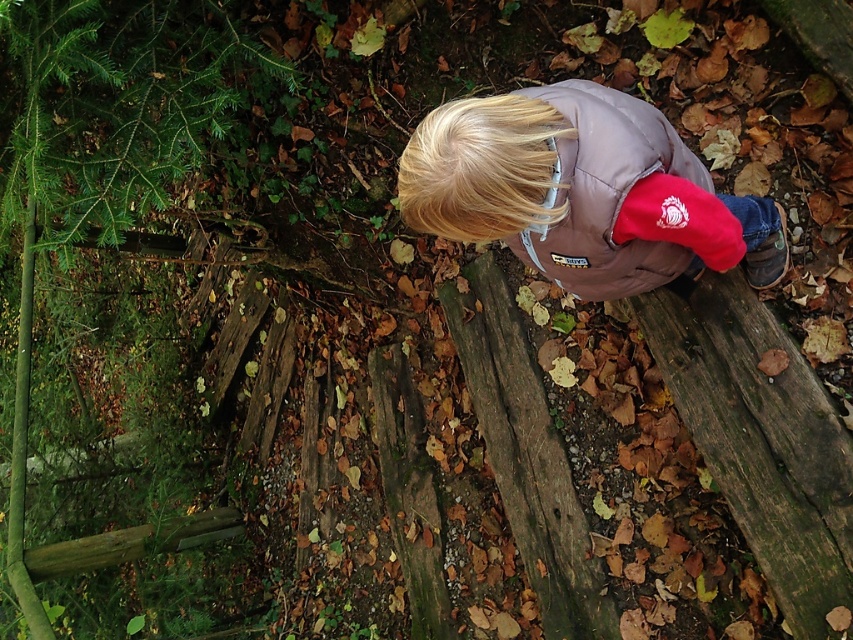
You are standing in a forest and see the green rough wood at center. If you want to reach it, how many steps would you need to take if each step is about 0.7 meters?

The green rough wood at center is 2.14 meters away. Since each step is about 0.7 meters, you would need to take approximately 3 steps to reach it.

You are navigating through a forest and need to locate the green textured pine tree at left. Based on the coordinates provided in the scene description, can you determine its position relative to the person working with the wooden planks?

The green textured pine tree at left is located at point coordinates, so it is positioned to the lower left of the person working with the wooden planks.

You are a hiker navigating through a forest and see the green textured pine tree at left and the brown matte jacket at center. Which object is closer to you as you walk towards them?

The green textured pine tree at left is closer to you because it is positioned further to the viewer than the brown matte jacket at center, meaning it appears nearer in the scene.